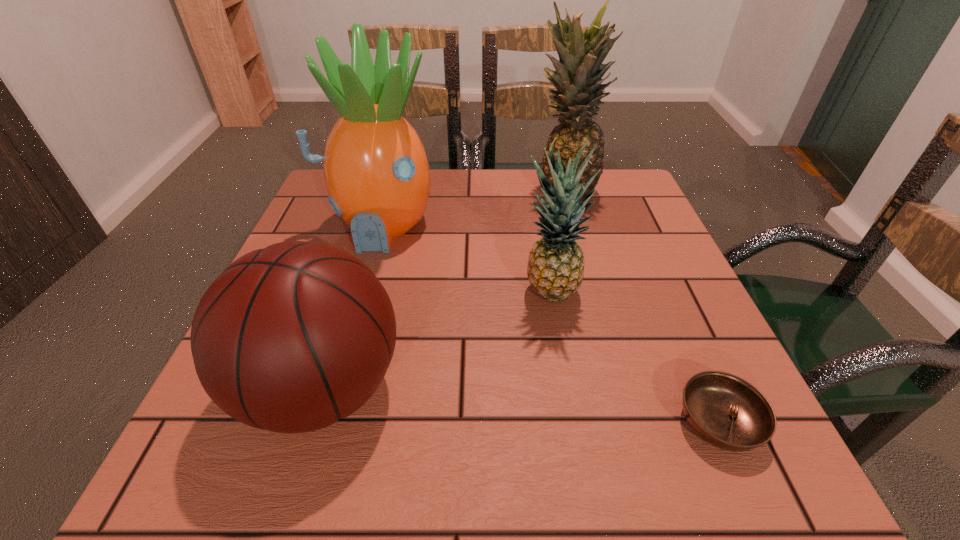
This screenshot has width=960, height=540. In order to click on object identified as the third closest to the second shortest object in this screenshot , I will do `click(726, 411)`.

This screenshot has width=960, height=540. Find the location of `object that is the closest to the third shortest object`. object that is the closest to the third shortest object is located at coordinates (726, 411).

Point out which pineapple is positioned as the second nearest to the soup bowl. Please provide its 2D coordinates. Your answer should be formatted as a tuple, i.e. [(x, y)], where the tuple contains the x and y coordinates of a point satisfying the conditions above.

[(376, 171)]

Point out which pineapple is positioned as the nearest to the leftmost pineapple. Please provide its 2D coordinates. Your answer should be formatted as a tuple, i.e. [(x, y)], where the tuple contains the x and y coordinates of a point satisfying the conditions above.

[(555, 270)]

This screenshot has width=960, height=540. Find the location of `free space that satisfies the following two spatial constraints: 1. at the entrance of the third farthest object; 2. on the right side of the leftmost pineapple`. free space that satisfies the following two spatial constraints: 1. at the entrance of the third farthest object; 2. on the right side of the leftmost pineapple is located at coordinates (359, 294).